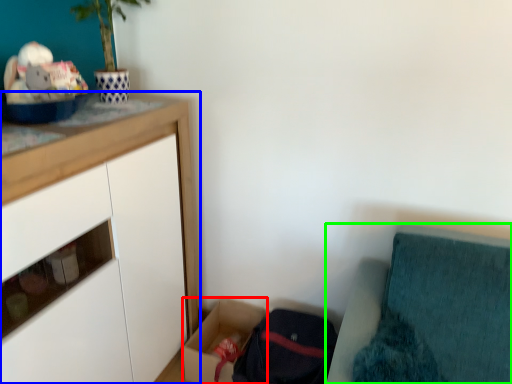
Question: Which object is positioned farthest from storage box (highlighted by a red box)? Select from cabinetry (highlighted by a blue box) and furniture (highlighted by a green box).

Choices:
 (A) cabinetry
 (B) furniture

Answer: (B)